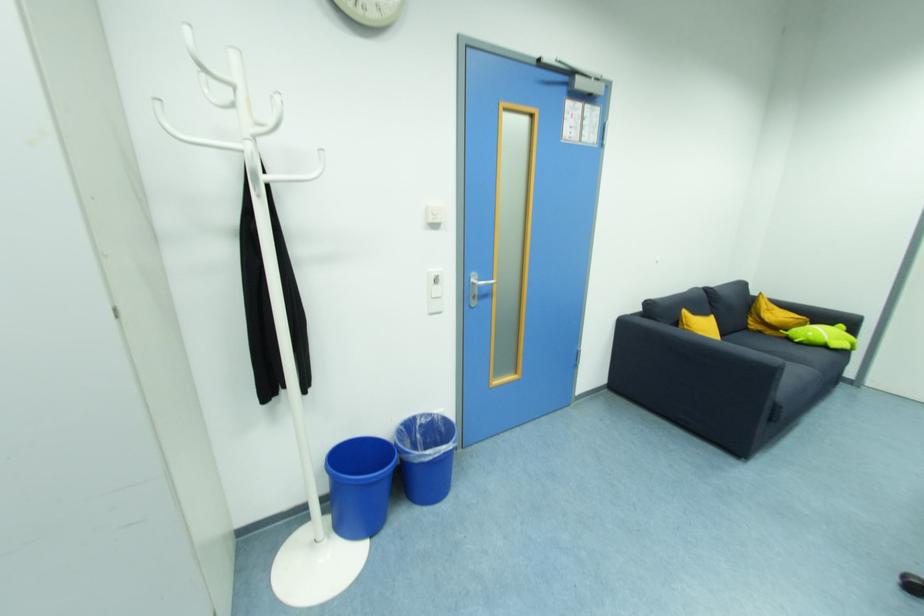
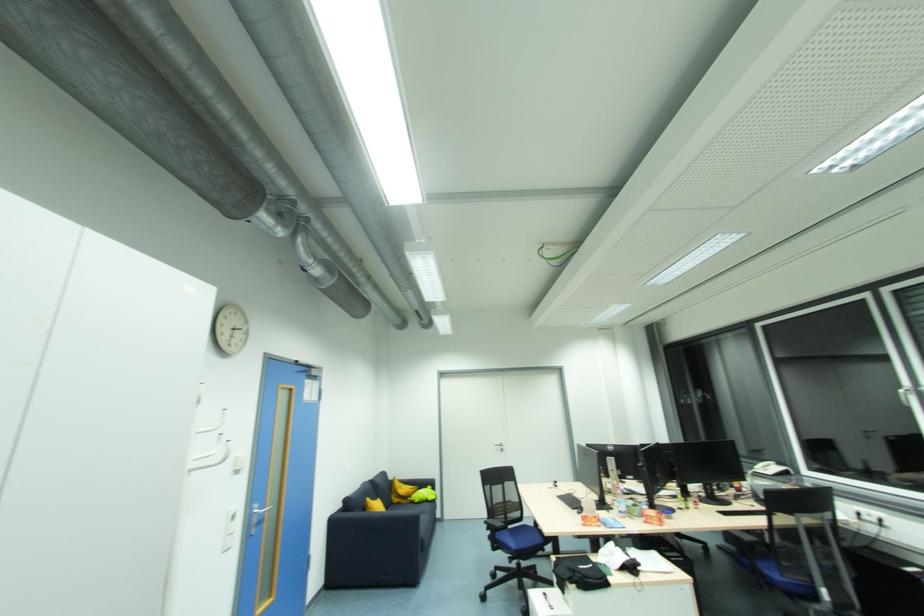
Where in the second image is the point corresponding to pixel 788 331 from the first image?

(412, 499)